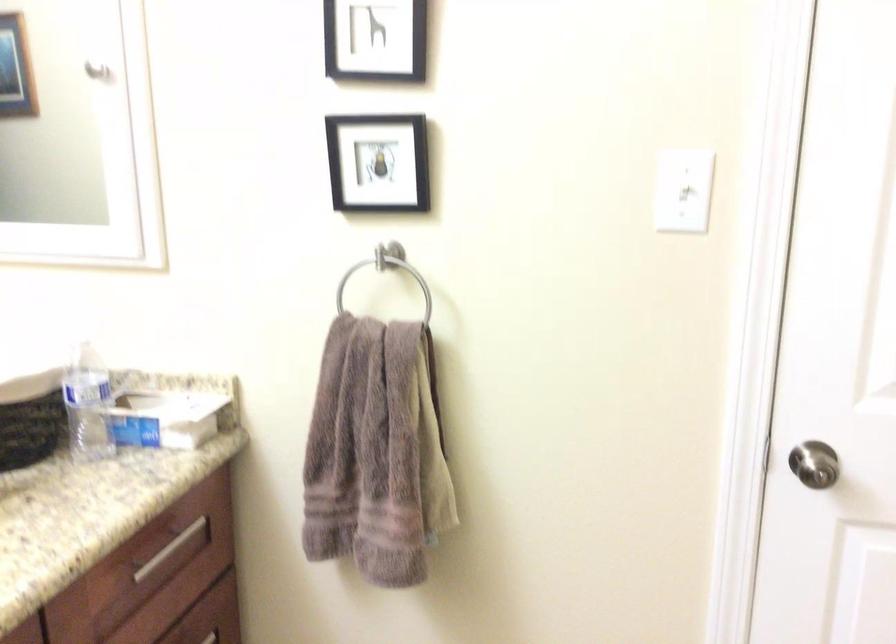
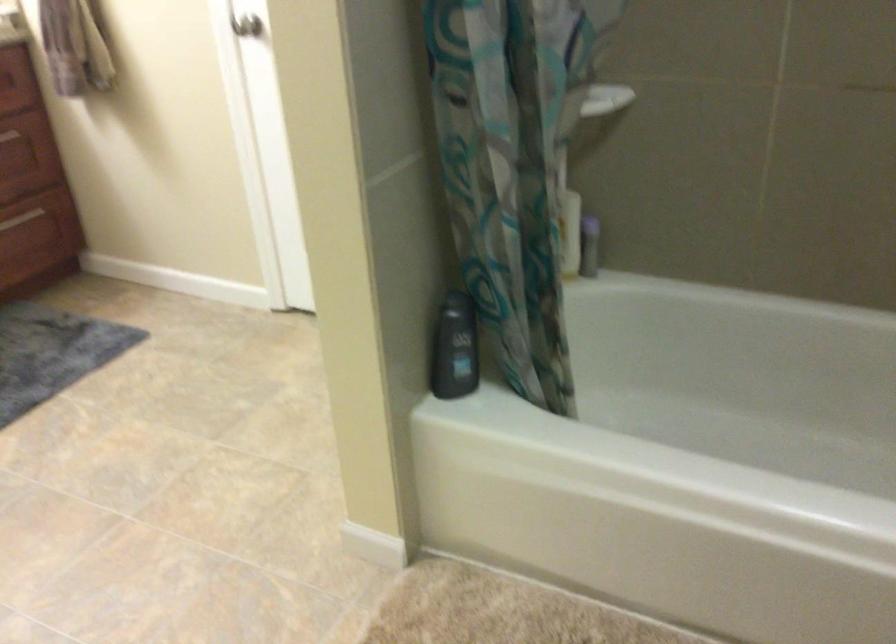
What movement of the cameraman would produce the second image?

The cameraman walked toward right, backward.